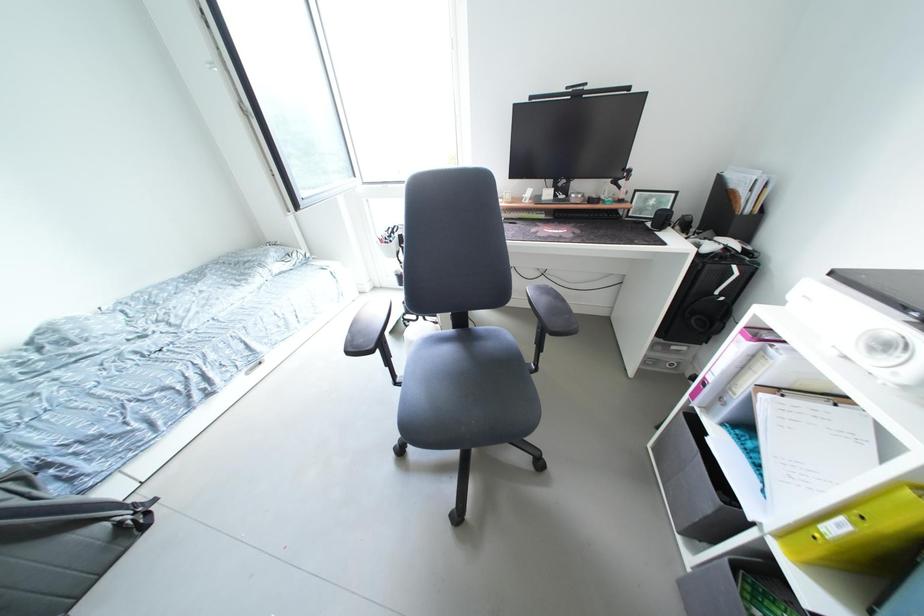
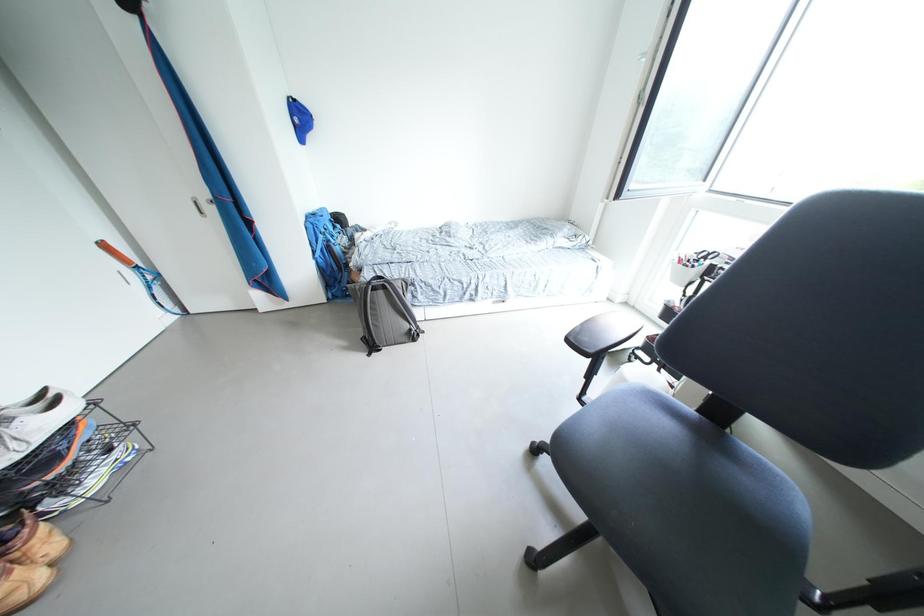
The first image is from the beginning of the video and the second image is from the end. How did the camera likely rotate when shooting the video?

The rotation direction of the camera is left-down.